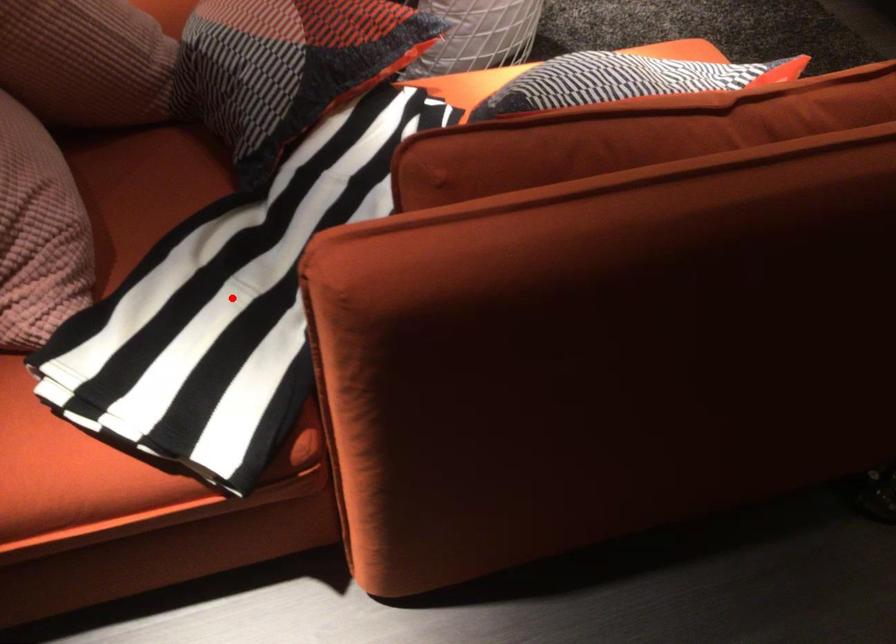
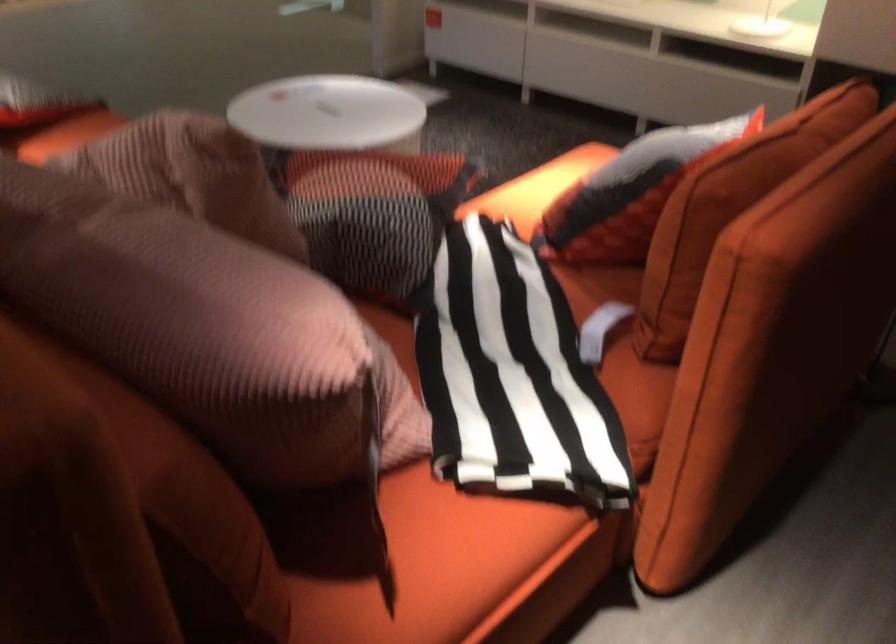
Where in the second image is the point corresponding to the highlighted location from the first image?

(512, 375)